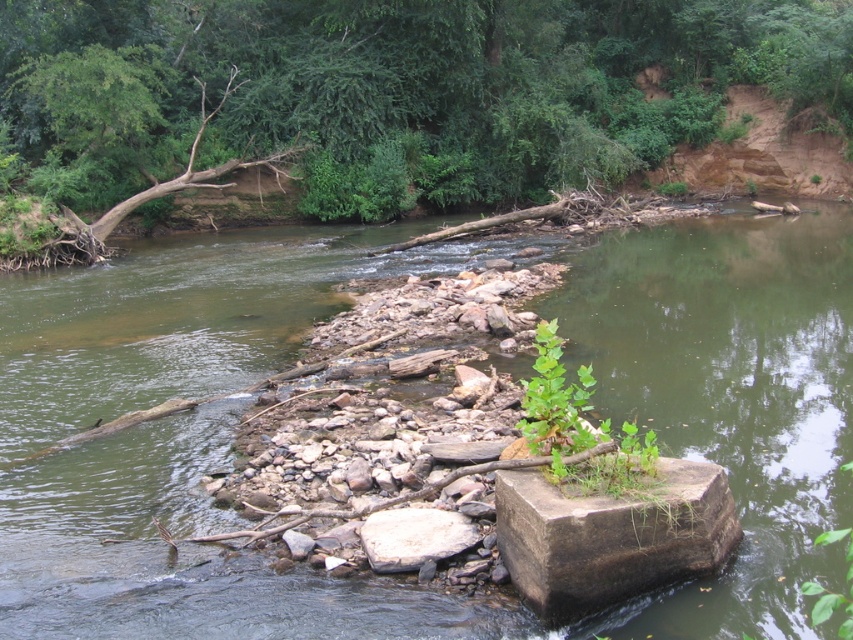
Looking at this image, you are standing on the riverbank and see the green stone at center and the brown concrete block at center. Which object is positioned to the right of the other?

The green stone at center is positioned to the right of the brown concrete block at center.

You are standing on the riverbank and want to place a small potted plant between the green stone at center and the white smooth rock at center. Which rock should the plant be closer to to ensure it is in front of both rocks?

The green stone at center is in front of the white smooth rock at center. To place the potted plant so it is in front of both rocks, position it closer to the green stone at center.

You are standing at the edge of the river and want to place a 10 feet long wooden board between the green stone at center and the brown concrete block at center. Can the board reach both objects without bending?

The green stone at center is 13.19 feet away from the brown concrete block at center. Since the wooden board is only 10 feet long, it cannot span the entire distance between them without bending.